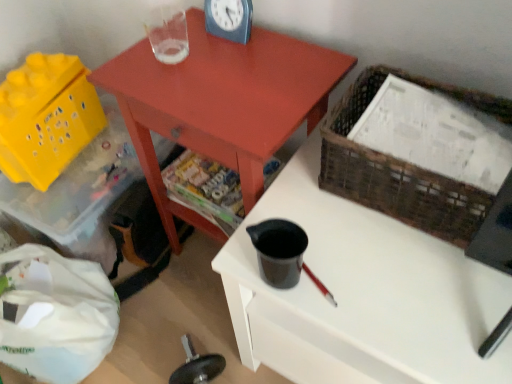
Question: Is blue plastic clock at upper center facing towards yellow plastic storage box at lower left?

Choices:
 (A) no
 (B) yes

Answer: (A)

Question: From a real-world perspective, is blue plastic clock at upper center physically above yellow plastic storage box at lower left?

Choices:
 (A) no
 (B) yes

Answer: (B)

Question: Can you confirm if blue plastic clock at upper center is smaller than yellow plastic storage box at lower left?

Choices:
 (A) no
 (B) yes

Answer: (B)

Question: Does blue plastic clock at upper center have a greater height compared to yellow plastic storage box at lower left?

Choices:
 (A) no
 (B) yes

Answer: (A)

Question: Can you confirm if blue plastic clock at upper center is bigger than yellow plastic storage box at lower left?

Choices:
 (A) yes
 (B) no

Answer: (B)

Question: Is blue plastic clock at upper center outside of yellow plastic storage box at lower left?

Choices:
 (A) yes
 (B) no

Answer: (A)

Question: From a real-world perspective, is yellow plastic basket at lower left, placed as the first basket when sorted from back to front, located higher than yellow plastic storage box at lower left?

Choices:
 (A) no
 (B) yes

Answer: (B)

Question: Does yellow plastic basket at lower left, which is counted as the first basket, starting from the left, have a greater height compared to yellow plastic storage box at lower left?

Choices:
 (A) no
 (B) yes

Answer: (A)

Question: Does yellow plastic basket at lower left, which is counted as the first basket, starting from the left, have a larger size compared to yellow plastic storage box at lower left?

Choices:
 (A) no
 (B) yes

Answer: (A)

Question: Is yellow plastic basket at lower left, which is counted as the first basket, starting from the left, turned away from yellow plastic storage box at lower left?

Choices:
 (A) yes
 (B) no

Answer: (B)

Question: Considering the relative sizes of yellow plastic basket at lower left, which is counted as the first basket, starting from the left, and yellow plastic storage box at lower left in the image provided, is yellow plastic basket at lower left, which is counted as the first basket, starting from the left, shorter than yellow plastic storage box at lower left?

Choices:
 (A) yes
 (B) no

Answer: (A)

Question: Is yellow plastic basket at lower left, acting as the second basket starting from the right, thinner than yellow plastic storage box at lower left?

Choices:
 (A) no
 (B) yes

Answer: (B)

Question: Is woven brown basket at upper right, which is the second basket in left-to-right order, inside yellow plastic basket at lower left, which is counted as the first basket, starting from the left?

Choices:
 (A) no
 (B) yes

Answer: (A)